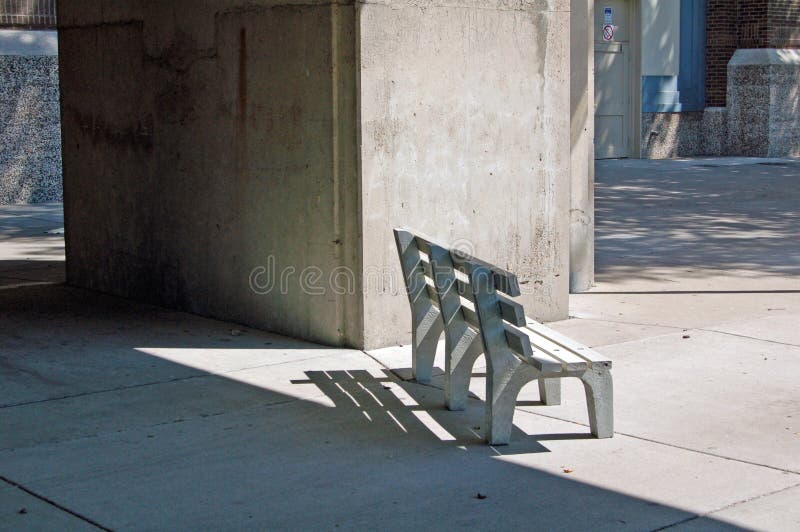
You are a GUI agent. You are given a task and a screenshot of the screen. Output one action in this format:
    pyautogui.click(x=<x>, y=<y>)
    Task: Click on the door
    
    Given the screenshot: What is the action you would take?
    pyautogui.click(x=610, y=99)